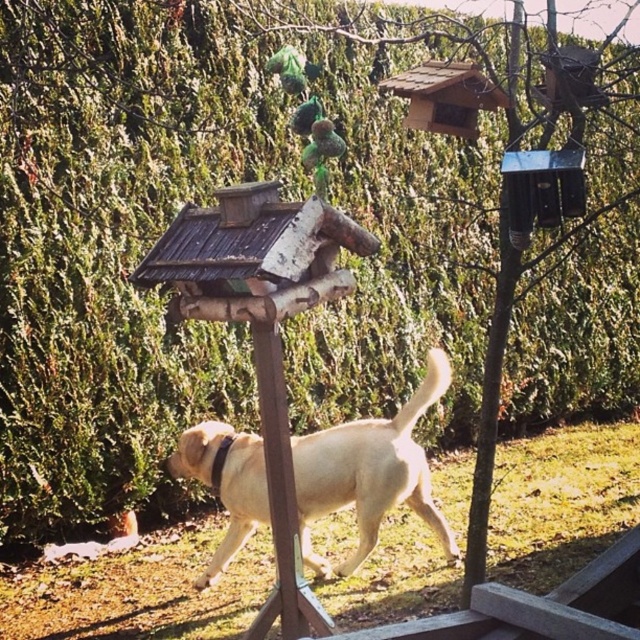
You are a small cat trying to decide which object to play with first between the green matte bird at center and the green fuzzy toy at center. Based on their sizes, which one do you think is wider?

The green matte bird at center is wider than the green fuzzy toy at center.

You are standing in the garden and notice the light yellow fur at center. Can you determine its exact position using the coordinate system provided?

The light yellow fur at center is located at point (369, 472) according to the coordinate system provided.

You are a small cat trying to decide whether to jump from the green fuzzy toy at center to the green matte bird at center. Based on their sizes, which one do you think is taller?

The green matte bird at center is much taller than the green fuzzy toy at center, so it is taller.